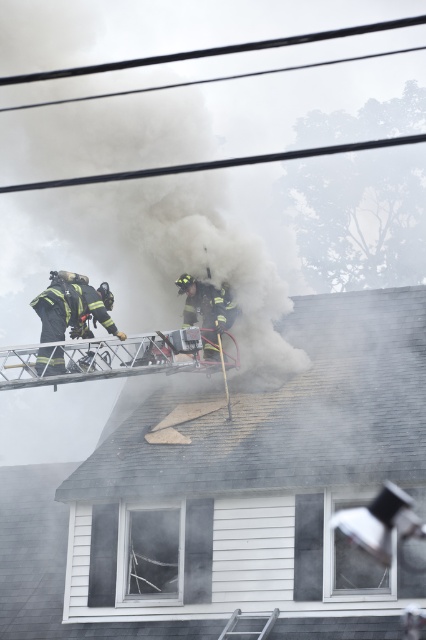
What is the 2D coordinate of the gray shingles at upper center in the image?

The gray shingles at upper center are located at the 2D coordinate point of (x=290, y=413).

You are a firefighter trying to reach the roof to extinguish the flames. You see the gray shingles at upper center and the black matte fireman at upper left. Which object is closer to the roof edge?

The gray shingles at upper center are located below the black matte fireman at upper left, meaning the fireman is closer to the roof edge than the shingles.